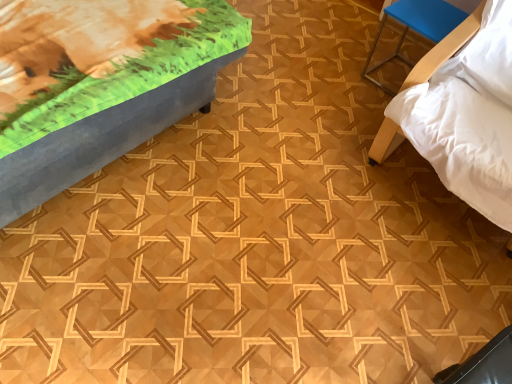
Find the location of a particular element. vacant area that lies between blue plastic stool at upper right, positioned as the 2th furniture in right-to-left order, and matte gray bench at upper left, acting as the 1th furniture starting from the left is located at coordinates (273, 106).